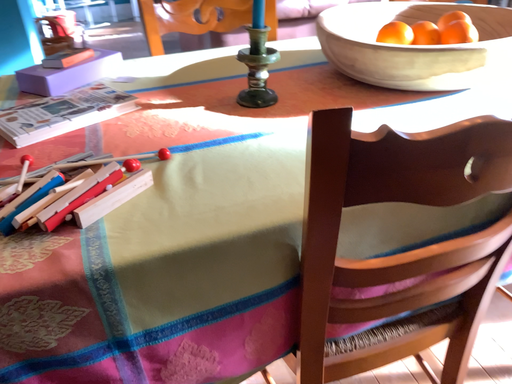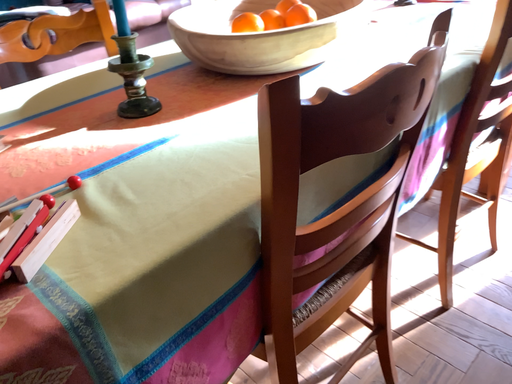
Question: How did the camera likely rotate when shooting the video?

Choices:
 (A) rotated right
 (B) rotated left

Answer: (A)